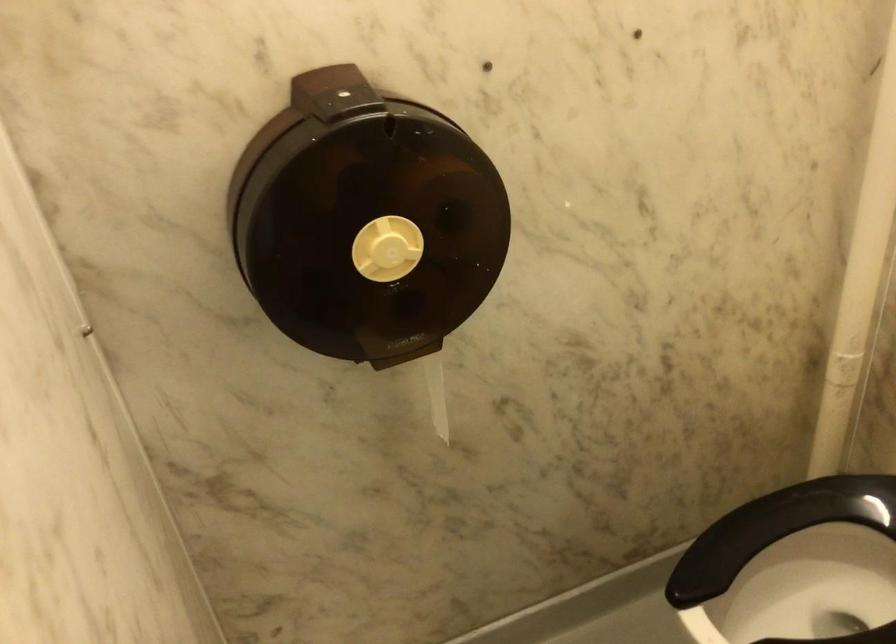
I want to click on dispenser turning knob, so click(386, 249).